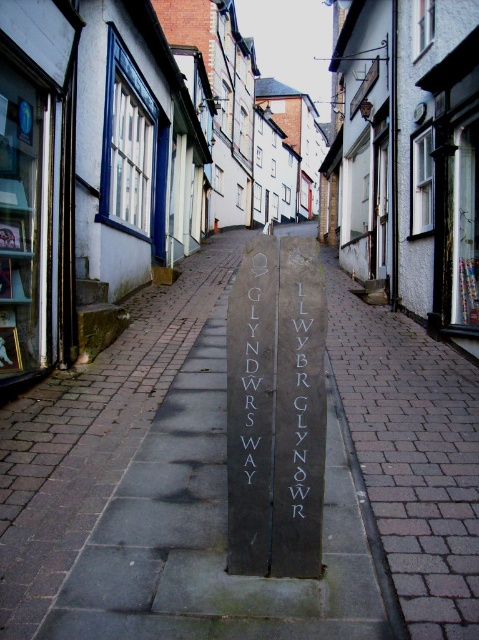
Is dark gray stone marker at center to the left of white stone writing at center from the viewer's perspective?

Incorrect, dark gray stone marker at center is not on the left side of white stone writing at center.

Is dark gray stone marker at center below white stone writing at center?

Indeed, dark gray stone marker at center is positioned under white stone writing at center.

At what (x,y) coordinates should I click in order to perform the action: click on dark gray stone marker at center. Please return your answer as a coordinate pair (x, y). Looking at the image, I should click on (215, 529).

How far apart are slate gray stone sign at center and white stone writing at center?

slate gray stone sign at center and white stone writing at center are 6.92 inches apart from each other.

Between point (251, 307) and point (298, 406), which one is positioned in front?

Point (298, 406) is more forward.

Locate an element on the screen. slate gray stone sign at center is located at coordinates (250, 388).

Does dark gray stone marker at center have a lesser height compared to slate gray stone sign at center?

Indeed, dark gray stone marker at center has a lesser height compared to slate gray stone sign at center.

Who is more distant from viewer, (x=328, y=600) or (x=249, y=481)?

Point (x=249, y=481)

The height and width of the screenshot is (640, 479). Identify the location of dark gray stone marker at center. (215, 529).